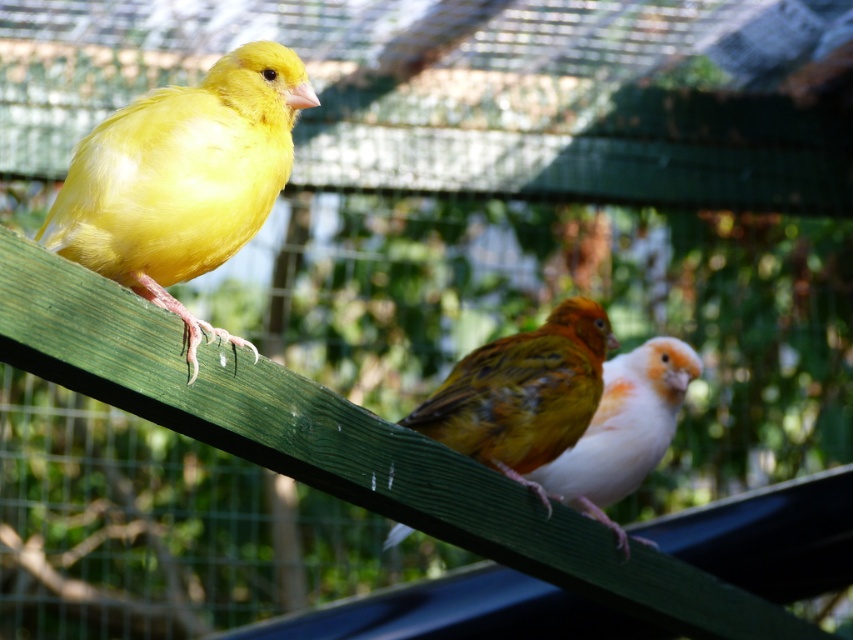
The width and height of the screenshot is (853, 640). Describe the element at coordinates (183, 179) in the screenshot. I see `matte yellow canary at left` at that location.

Can you confirm if matte yellow canary at left is positioned below white feathered bird at center?

Incorrect, matte yellow canary at left is not positioned below white feathered bird at center.

Describe the element at coordinates (183, 179) in the screenshot. The height and width of the screenshot is (640, 853). I see `matte yellow canary at left` at that location.

At what (x,y) coordinates should I click in order to perform the action: click on matte yellow canary at left. Please return your answer as a coordinate pair (x, y). The width and height of the screenshot is (853, 640). Looking at the image, I should click on coord(183,179).

Between point (426, 420) and point (608, 401), which one is positioned behind?

The point (608, 401) is more distant.

In the scene shown: Between orange-brown speckled bird at center and white feathered bird at center, which one is positioned higher?

orange-brown speckled bird at center is above.

This screenshot has height=640, width=853. Identify the location of orange-brown speckled bird at center. (521, 394).

Image resolution: width=853 pixels, height=640 pixels. In order to click on orange-brown speckled bird at center in this screenshot , I will do `click(521, 394)`.

Who is higher up, matte yellow canary at left or orange-brown speckled bird at center?

matte yellow canary at left is above.

From the picture: Is matte yellow canary at left to the right of orange-brown speckled bird at center from the viewer's perspective?

In fact, matte yellow canary at left is to the left of orange-brown speckled bird at center.

Find the location of a particular element. This screenshot has height=640, width=853. matte yellow canary at left is located at coordinates (183, 179).

Where is `matte yellow canary at left`? The image size is (853, 640). matte yellow canary at left is located at coordinates (183, 179).